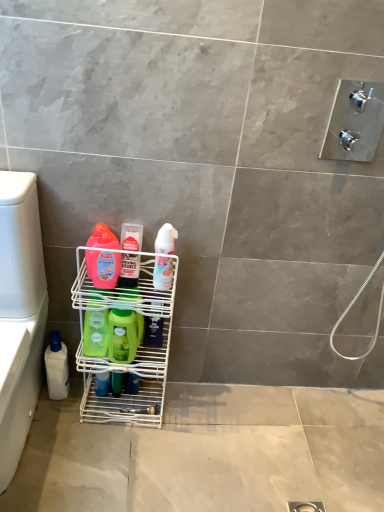
Question: Does green matte bottle at center, the fourth cleaning product from the left, have a lesser width compared to white wire rack at lower left?

Choices:
 (A) no
 (B) yes

Answer: (B)

Question: Is green matte bottle at center, the fourth cleaning product in the right-to-left sequence, far away from white wire rack at lower left?

Choices:
 (A) no
 (B) yes

Answer: (A)

Question: Does green matte bottle at center, the fourth cleaning product from the left, have a greater width compared to white wire rack at lower left?

Choices:
 (A) no
 (B) yes

Answer: (A)

Question: Does green matte bottle at center, the fourth cleaning product from the left, have a smaller size compared to white wire rack at lower left?

Choices:
 (A) no
 (B) yes

Answer: (B)

Question: Is green matte bottle at center, the fourth cleaning product in the right-to-left sequence, taller than white wire rack at lower left?

Choices:
 (A) no
 (B) yes

Answer: (A)

Question: From a real-world perspective, relative to green matte bottle at center, arranged as the sixth cleaning product when viewed from the right, is translucent plastic bottle at center, which appears as the 5th cleaning product when viewed from the left, vertically above or below?

Choices:
 (A) above
 (B) below

Answer: (A)

Question: Choose the correct answer: Is translucent plastic bottle at center, arranged as the third cleaning product when viewed from the right, inside green matte bottle at center, which ranks as the 2th cleaning product in left-to-right order, or outside it?

Choices:
 (A) outside
 (B) inside

Answer: (A)

Question: Relative to green matte bottle at center, arranged as the sixth cleaning product when viewed from the right, is translucent plastic bottle at center, which appears as the 5th cleaning product when viewed from the left, in front or behind?

Choices:
 (A) front
 (B) behind

Answer: (A)

Question: Visually, is translucent plastic bottle at center, which appears as the 5th cleaning product when viewed from the left, positioned to the left or to the right of green matte bottle at center, arranged as the sixth cleaning product when viewed from the right?

Choices:
 (A) right
 (B) left

Answer: (A)

Question: Is white plastic bottle at lower left wider or thinner than white glossy lotion at center, the 7th cleaning product positioned from the left?

Choices:
 (A) wide
 (B) thin

Answer: (A)

Question: Considering the positions of point click(x=23, y=260) and point click(x=153, y=269), is point click(x=23, y=260) closer or farther from the camera than point click(x=153, y=269)?

Choices:
 (A) closer
 (B) farther

Answer: (A)

Question: Is white plastic bottle at lower left in front of or behind white glossy lotion at center, the 7th cleaning product positioned from the left, in the image?

Choices:
 (A) behind
 (B) front

Answer: (B)

Question: In the image, is white plastic bottle at lower left on the left side or the right side of white glossy lotion at center, the 7th cleaning product positioned from the left?

Choices:
 (A) right
 (B) left

Answer: (B)

Question: From the image's perspective, is white wire rack at lower left located above or below white plastic bottle at lower left?

Choices:
 (A) below
 (B) above

Answer: (B)

Question: From a real-world perspective, is white wire rack at lower left physically located above or below white plastic bottle at lower left?

Choices:
 (A) above
 (B) below

Answer: (B)